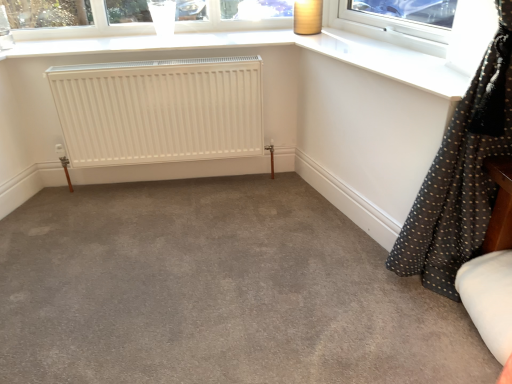
I want to click on matte brown lampshade at upper right, so click(x=307, y=17).

What do you see at coordinates (307, 17) in the screenshot?
I see `matte brown lampshade at upper right` at bounding box center [307, 17].

What is the approximate width of black dotted fabric at right?

23.68 inches.

Locate an element on the screen. The image size is (512, 384). clear glass window at upper center is located at coordinates (78, 26).

This screenshot has height=384, width=512. What do you see at coordinates (159, 110) in the screenshot?
I see `white matte radiator at center` at bounding box center [159, 110].

Identify the location of matte brown lampshade at upper right. (307, 17).

In the scene shown: From a real-world perspective, is gray carpet at center below matte brown lampshade at upper right?

Yes, from a real-world perspective, gray carpet at center is under matte brown lampshade at upper right.

Who is smaller, gray carpet at center or matte brown lampshade at upper right?

With smaller size is matte brown lampshade at upper right.

How far apart are gray carpet at center and matte brown lampshade at upper right?

gray carpet at center is 1.38 meters from matte brown lampshade at upper right.

In the scene shown: Considering the relative sizes of matte brown lampshade at upper right and white matte radiator at center in the image provided, is matte brown lampshade at upper right thinner than white matte radiator at center?

Incorrect, the width of matte brown lampshade at upper right is not less than that of white matte radiator at center.

Considering the positions of point (293, 28) and point (87, 100), is point (293, 28) closer or farther from the camera than point (87, 100)?

Point (293, 28) is positioned farther from the camera compared to point (87, 100).

Is matte brown lampshade at upper right bigger or smaller than white matte radiator at center?

In the image, matte brown lampshade at upper right appears to be smaller than white matte radiator at center.

Can you confirm if gray carpet at center is thinner than black dotted fabric at right?

No, gray carpet at center is not thinner than black dotted fabric at right.

This screenshot has width=512, height=384. There is a gray carpet at center. In order to click on curtain above it (from a real-world perspective) in this screenshot , I will do `click(461, 175)`.

Is gray carpet at center oriented towards black dotted fabric at right?

Yes, gray carpet at center is facing black dotted fabric at right.

Is gray carpet at center placed right next to black dotted fabric at right?

No, gray carpet at center is not beside black dotted fabric at right.

Considering the relative sizes of clear glass window at upper center and white matte radiator at center in the image provided, is clear glass window at upper center shorter than white matte radiator at center?

Yes.

Are clear glass window at upper center and white matte radiator at center making contact?

clear glass window at upper center and white matte radiator at center are not in contact.

From the image's perspective, relative to white matte radiator at center, is clear glass window at upper center above or below?

From the image's perspective, clear glass window at upper center appears above white matte radiator at center.

Is white matte radiator at center inside black dotted fabric at right?

No, white matte radiator at center is not a part of black dotted fabric at right.

From a real-world perspective, between black dotted fabric at right and white matte radiator at center, who is vertically lower?

white matte radiator at center is physically lower.

Is black dotted fabric at right next to white matte radiator at center and touching it?

No, black dotted fabric at right is not next to white matte radiator at center.

From the image's perspective, is black dotted fabric at right located above or below white matte radiator at center?

black dotted fabric at right is below white matte radiator at center.

Is clear glass window at upper center looking in the opposite direction of gray carpet at center?

clear glass window at upper center does not have its back to gray carpet at center.

Who is smaller, clear glass window at upper center or gray carpet at center?

clear glass window at upper center.

Is clear glass window at upper center not close to gray carpet at center?

Yes, clear glass window at upper center and gray carpet at center are quite far apart.

Find the location of `radiator behind the gray carpet at center`. radiator behind the gray carpet at center is located at coordinates (159, 110).

Is white matte radiator at center positioned before gray carpet at center?

No, the depth of white matte radiator at center is greater than that of gray carpet at center.

Is white matte radiator at center taller or shorter than gray carpet at center?

Clearly, white matte radiator at center is taller compared to gray carpet at center.

Is white matte radiator at center at the left side of gray carpet at center?

→ Yes.

Where is `concrete below the matte brown lampshade at upper right (from the image's perspective)`? concrete below the matte brown lampshade at upper right (from the image's perspective) is located at coordinates (216, 291).

This screenshot has width=512, height=384. I want to click on lamp behind the white matte radiator at center, so click(x=307, y=17).

From the image, which object appears to be nearer to matte brown lampshade at upper right, white matte radiator at center or clear glass window at upper center?

clear glass window at upper center.

Based on their spatial positions, is gray carpet at center or clear glass window at upper center closer to matte brown lampshade at upper right?

The object closer to matte brown lampshade at upper right is clear glass window at upper center.

Looking at the image, which one is located further to black dotted fabric at right, clear glass window at upper center or matte brown lampshade at upper right?

clear glass window at upper center is positioned further to the anchor black dotted fabric at right.

Estimate the real-world distances between objects in this image. Which object is further from white matte radiator at center, clear glass window at upper center or matte brown lampshade at upper right?

The object further to white matte radiator at center is matte brown lampshade at upper right.

Looking at the image, which one is located closer to matte brown lampshade at upper right, clear glass window at upper center or gray carpet at center?

The object closer to matte brown lampshade at upper right is clear glass window at upper center.

When comparing their distances from black dotted fabric at right, does matte brown lampshade at upper right or white matte radiator at center seem closer?

Based on the image, white matte radiator at center appears to be nearer to black dotted fabric at right.

From the image, which object appears to be nearer to matte brown lampshade at upper right, black dotted fabric at right or clear glass window at upper center?

clear glass window at upper center.

Considering their positions, is black dotted fabric at right positioned closer to gray carpet at center than matte brown lampshade at upper right?

black dotted fabric at right is positioned closer to the anchor gray carpet at center.

You are a GUI agent. You are given a task and a screenshot of the screen. Output one action in this format:
    pyautogui.click(x=<x>, y=<y>)
    Task: Click on the lamp between clear glass window at upper center and gray carpet at center from top to bottom
    The width and height of the screenshot is (512, 384).
    Given the screenshot: What is the action you would take?
    pyautogui.click(x=307, y=17)

Locate an element on the screen. Image resolution: width=512 pixels, height=384 pixels. concrete between black dotted fabric at right and matte brown lampshade at upper right along the z-axis is located at coordinates (216, 291).

Identify the location of radiator between clear glass window at upper center and black dotted fabric at right from left to right. The image size is (512, 384). (159, 110).

The image size is (512, 384). What are the coordinates of `radiator between black dotted fabric at right and matte brown lampshade at upper right from front to back` in the screenshot? It's located at 159,110.